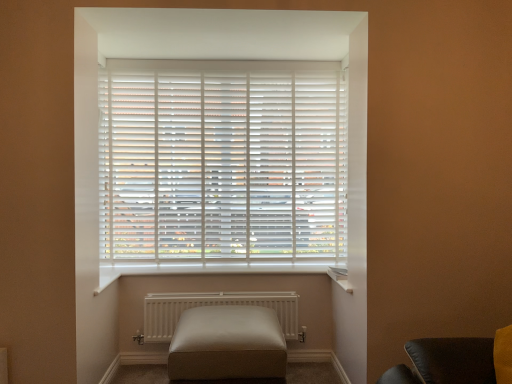
Question: Looking at their shapes, would you say white matte radiator at center is wider or thinner than white matte blinds at center?

Choices:
 (A) wide
 (B) thin

Answer: (A)

Question: From a real-world perspective, is white matte radiator at center above or below white matte blinds at center?

Choices:
 (A) above
 (B) below

Answer: (B)

Question: Which object is the closest to the white matte blinds at center?

Choices:
 (A) leather ottoman at center
 (B) white matte radiator at center

Answer: (B)

Question: Estimate the real-world distances between objects in this image. Which object is closer to the white matte radiator at center?

Choices:
 (A) leather ottoman at center
 (B) white matte blinds at center

Answer: (A)